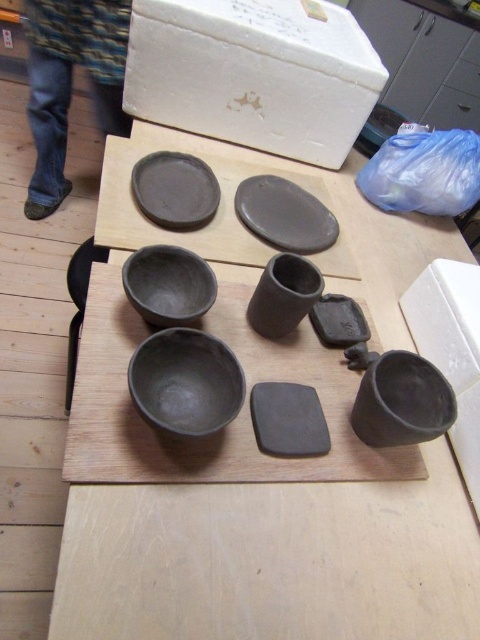
Question: Is matte black bowl at center above matte black bowl at center-left?

Choices:
 (A) yes
 (B) no

Answer: (B)

Question: Which object is the farthest from the matte black plate at upper center?

Choices:
 (A) matte black cup at center
 (B) matte clay bowls at center
 (C) matte black bowl at center-left

Answer: (B)

Question: In this image, where is matte clay bowls at center located relative to matte black bowl at center?

Choices:
 (A) above
 (B) below

Answer: (B)

Question: Which of these objects is positioned closest to the matte black plate at upper center?

Choices:
 (A) matte black plate at upper left
 (B) matte black cup at center
 (C) matte black cup at lower right

Answer: (A)

Question: Which point is farther to the camera?

Choices:
 (A) matte black cup at lower right
 (B) matte black bowl at center-left
 (C) matte black plate at upper left
 (D) matte black bowl at center

Answer: (C)

Question: Is the position of matte clay bowls at center less distant than that of matte black plate at upper left?

Choices:
 (A) no
 (B) yes

Answer: (B)